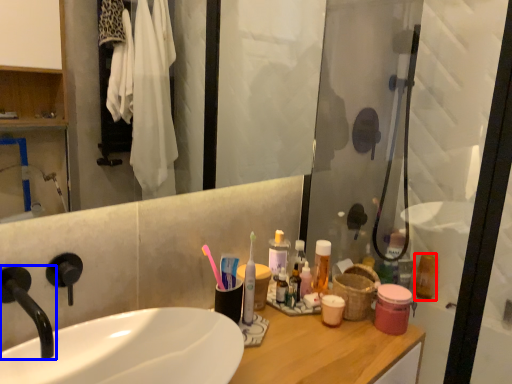
Question: Which object appears farthest to the camera in this image, mouthwash (highlighted by a red box) or tap (highlighted by a blue box)?

Choices:
 (A) mouthwash
 (B) tap

Answer: (A)